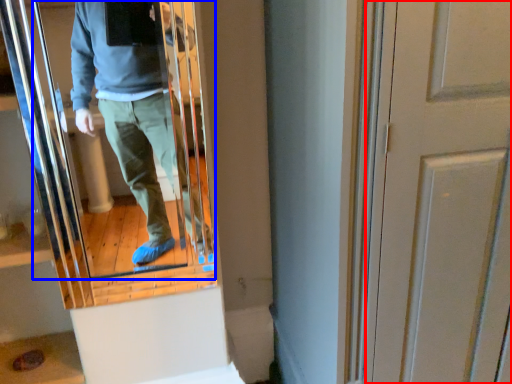
Question: Which point is further to the camera, door (highlighted by a red box) or mirror (highlighted by a blue box)?

Choices:
 (A) door
 (B) mirror

Answer: (B)